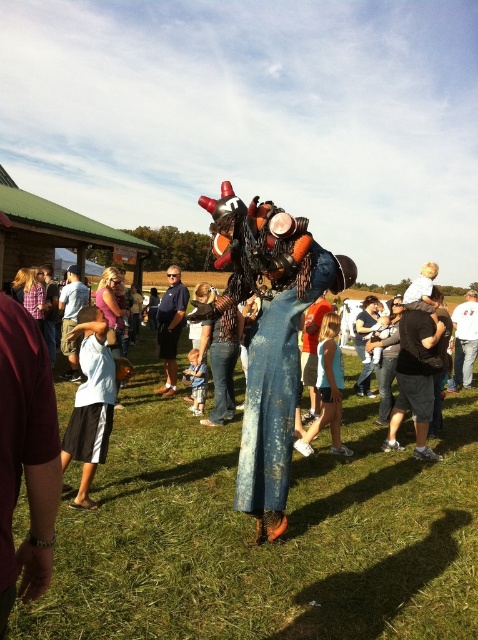
Question: In this image, where is white cotton shirt at lower left located relative to dark blue jeans at center?

Choices:
 (A) above
 (B) below

Answer: (B)

Question: Does dark blue jeans at center appear over denim jeans at center?

Choices:
 (A) yes
 (B) no

Answer: (A)

Question: Which object appears closest to the camera in this image?

Choices:
 (A) dark blue jeans at center
 (B) white cotton shirt at lower left
 (C) green grass at center
 (D) denim jeans at center

Answer: (C)

Question: Which of the following is the farthest from the observer?

Choices:
 (A) denim jeans at center
 (B) green grass at center
 (C) dark blue jeans at center

Answer: (A)

Question: Does dark blue jeans at center have a larger size compared to denim jeans at center?

Choices:
 (A) yes
 (B) no

Answer: (A)

Question: Which of the following is the closest to the observer?

Choices:
 (A) (477, 308)
 (B) (97, 410)
 (C) (144, 371)

Answer: (B)